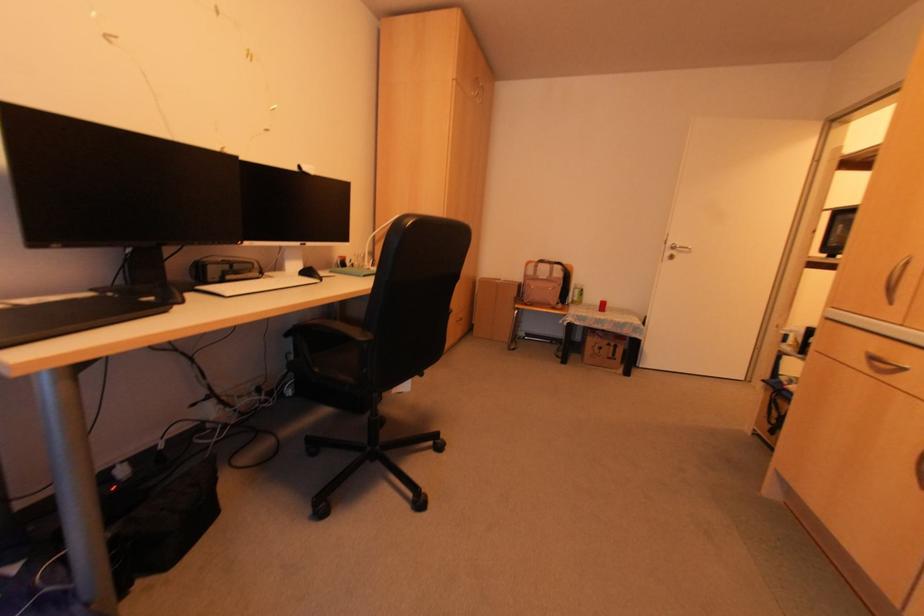
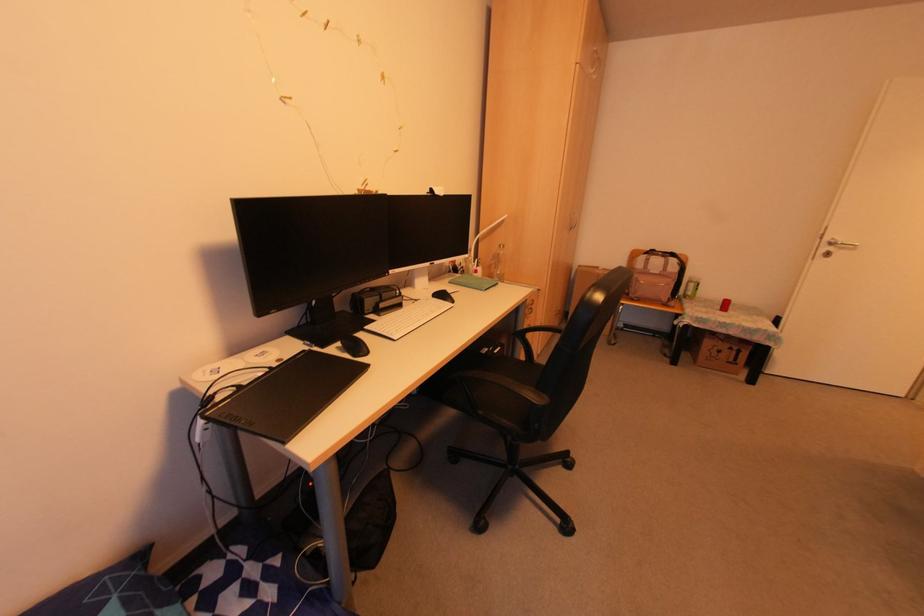
In the second image, find the point that corresponds to (601,307) in the first image.

(723, 306)